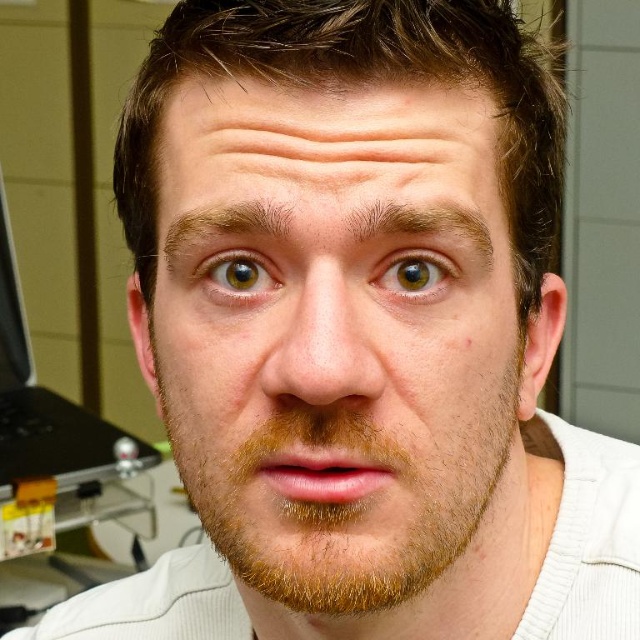
Can you confirm if smooth skin face at center is positioned below green matte eye at upper center?

Indeed, smooth skin face at center is positioned under green matte eye at upper center.

Measure the distance between smooth skin face at center and camera.

smooth skin face at center is 10.10 inches from camera.

Locate an element on the screen. The height and width of the screenshot is (640, 640). smooth skin face at center is located at coordinates (339, 340).

Which is more to the right, black plastic laptop at left or green matte eye at center?

From the viewer's perspective, green matte eye at center appears more on the right side.

Which is above, black plastic laptop at left or green matte eye at center?

Positioned higher is green matte eye at center.

Is point (77, 468) less distant than point (260, 282)?

No, (77, 468) is further to viewer.

The height and width of the screenshot is (640, 640). I want to click on black plastic laptop at left, so click(44, 404).

Between smooth skin face at center and green matte eye at center, which one is positioned higher?

green matte eye at center is higher up.

Can you confirm if smooth skin face at center is taller than green matte eye at center?

Yes, smooth skin face at center is taller than green matte eye at center.

Measure the distance between smooth skin face at center and camera.

smooth skin face at center and camera are 10.10 inches apart from each other.

This screenshot has height=640, width=640. Identify the location of smooth skin face at center. (339, 340).